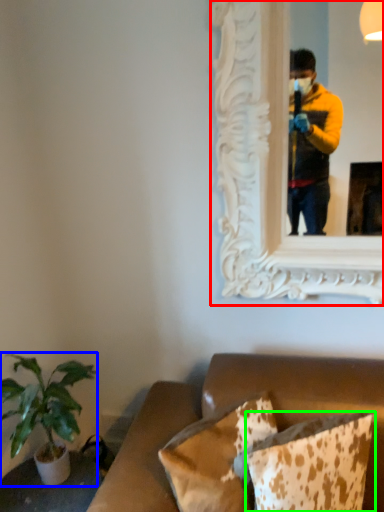
Question: Which object is positioned farthest from picture frame (highlighted by a red box)? Select from houseplant (highlighted by a blue box) and pillow (highlighted by a green box).

Choices:
 (A) houseplant
 (B) pillow

Answer: (A)